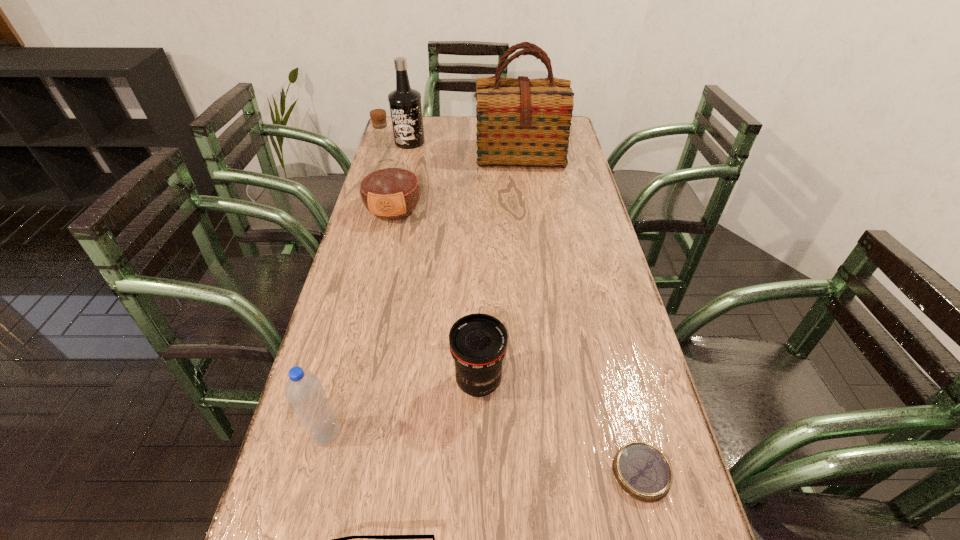
Where is `vacant region at the far edge`? The width and height of the screenshot is (960, 540). vacant region at the far edge is located at coordinates (475, 139).

This screenshot has width=960, height=540. I want to click on free space at the left edge of the desktop, so click(364, 216).

Locate an element on the screen. This screenshot has height=540, width=960. free spot at the right edge of the desktop is located at coordinates (596, 261).

Identify the location of empty space that is in between the shortest object and the water bottle. (484, 453).

Where is `free space between the nearer liquor and the fifth tallest object`? free space between the nearer liquor and the fifth tallest object is located at coordinates (436, 295).

Where is `vacant space that's between the compass and the water bottle`? Image resolution: width=960 pixels, height=540 pixels. vacant space that's between the compass and the water bottle is located at coordinates point(484,453).

You are a GUI agent. You are given a task and a screenshot of the screen. Output one action in this format:
    pyautogui.click(x=<x>, y=<y>)
    Task: Click on the free space between the third farthest object and the shortest object
    The width and height of the screenshot is (960, 540).
    Given the screenshot: What is the action you would take?
    pyautogui.click(x=517, y=341)

This screenshot has height=540, width=960. I want to click on free spot between the compass and the farther liquor, so click(x=525, y=307).

Where is `free area in between the fourth nearest object and the shortest object`? free area in between the fourth nearest object and the shortest object is located at coordinates (560, 427).

Where is `vacant point located between the farther liquor and the fourth farthest object`? vacant point located between the farther liquor and the fourth farthest object is located at coordinates (444, 261).